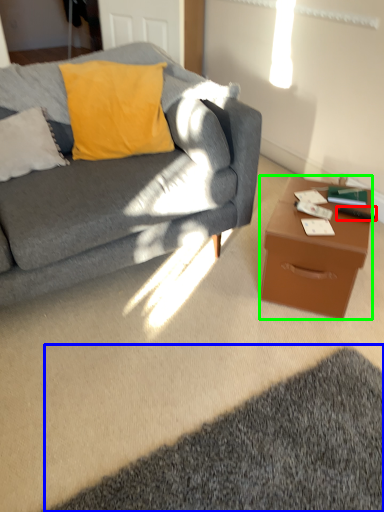
Question: Which is nearer to the remote control (highlighted by a red box)? mat (highlighted by a blue box) or desk (highlighted by a green box).

Choices:
 (A) mat
 (B) desk

Answer: (B)